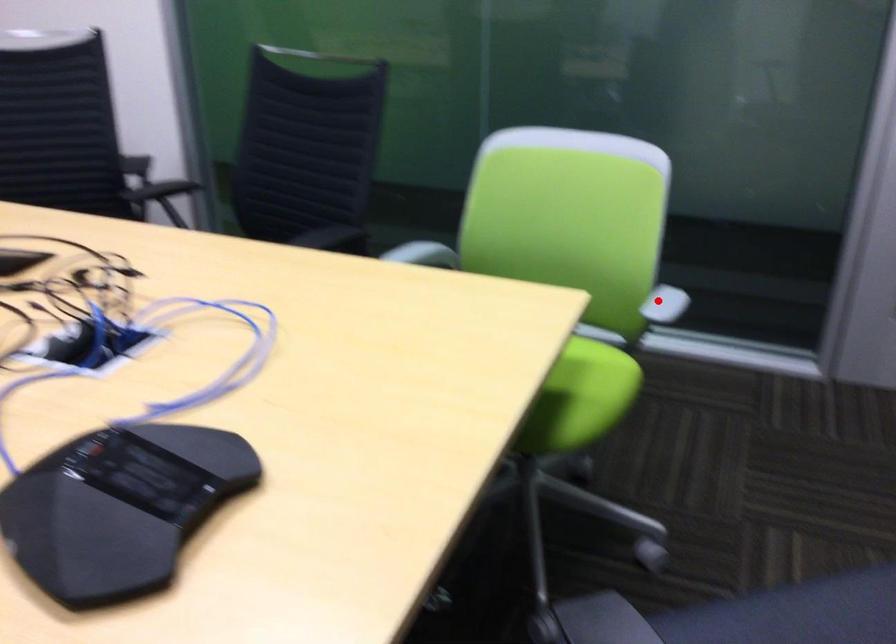
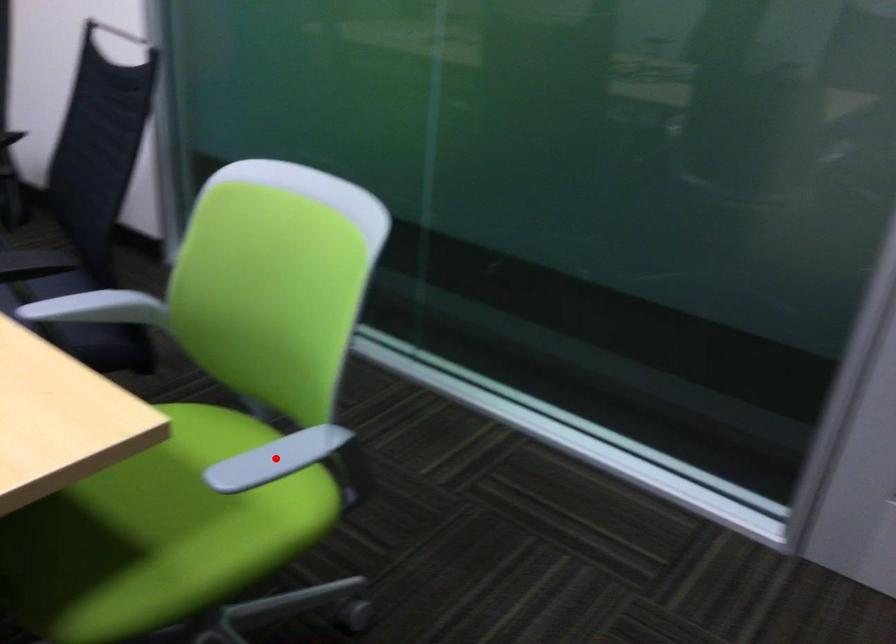
I am providing you with two images of the same scene from different viewpoints. A red point is marked on the first image and another point is marked on the second image. Is the red point in image1 aligned with the point shown in image2?

Yes